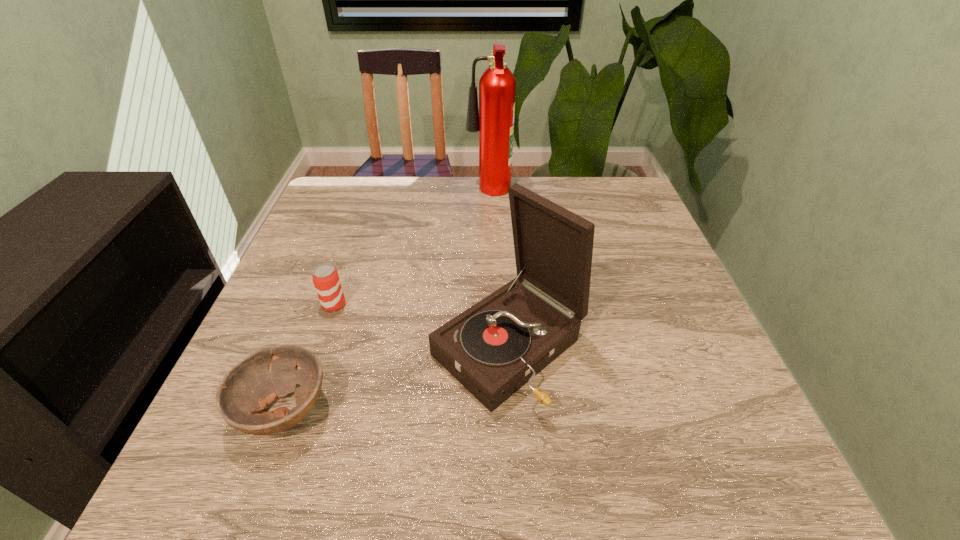
Find the location of a particular element. object identified as the closest to the farthest object is located at coordinates (495, 347).

Point out which object is positioned as the third nearest to the shortest object. Please provide its 2D coordinates. Your answer should be formatted as a tuple, i.e. [(x, y)], where the tuple contains the x and y coordinates of a point satisfying the conditions above.

[(494, 119)]

You are a GUI agent. You are given a task and a screenshot of the screen. Output one action in this format:
    pyautogui.click(x=<x>, y=<y>)
    Task: Click on the blank space that satisfies the following two spatial constraints: 1. on the front side of the second tallest object; 2. on the right side of the beer can
    
    Given the screenshot: What is the action you would take?
    pyautogui.click(x=319, y=349)

Identify the location of free spot that satisfies the following two spatial constraints: 1. at the nozzle of the fire extinguisher; 2. on the right side of the third shortest object. Image resolution: width=960 pixels, height=540 pixels. (493, 349).

Where is `vacant space that satisfies the following two spatial constraints: 1. at the nozzle of the third shortest object; 2. on the left side of the tallest object`? This screenshot has width=960, height=540. vacant space that satisfies the following two spatial constraints: 1. at the nozzle of the third shortest object; 2. on the left side of the tallest object is located at coordinates (493, 349).